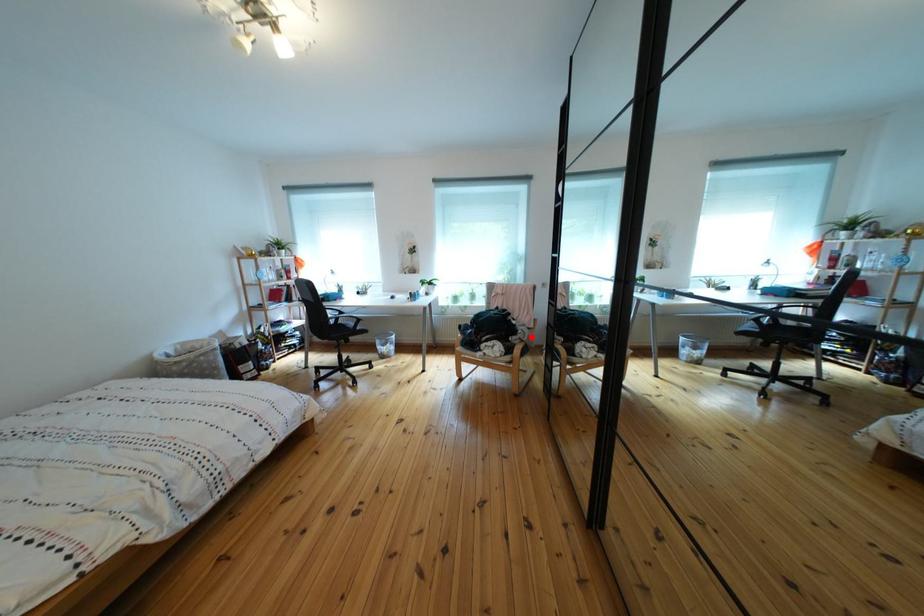
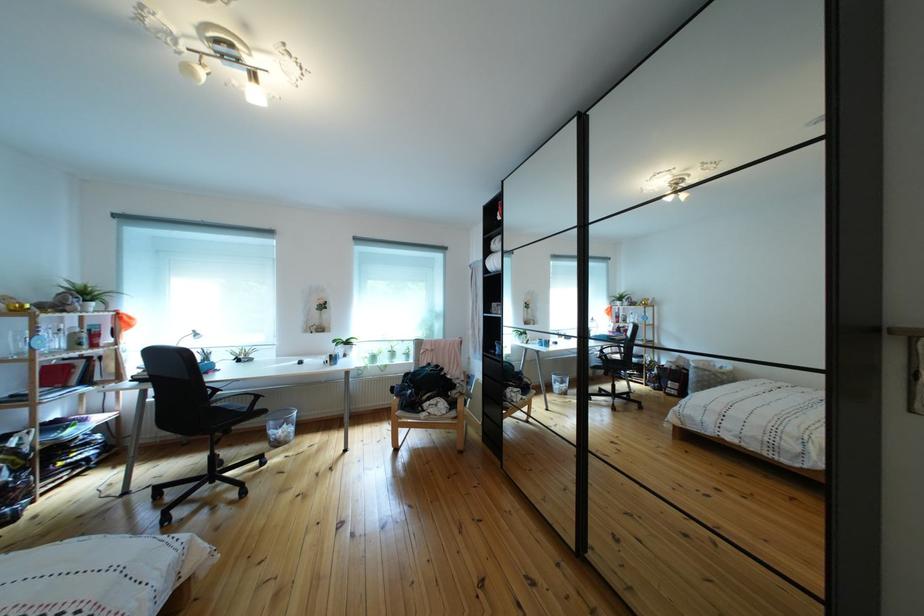
The point at the highlighted location is marked in the first image. Where is the corresponding point in the second image?

(469, 391)